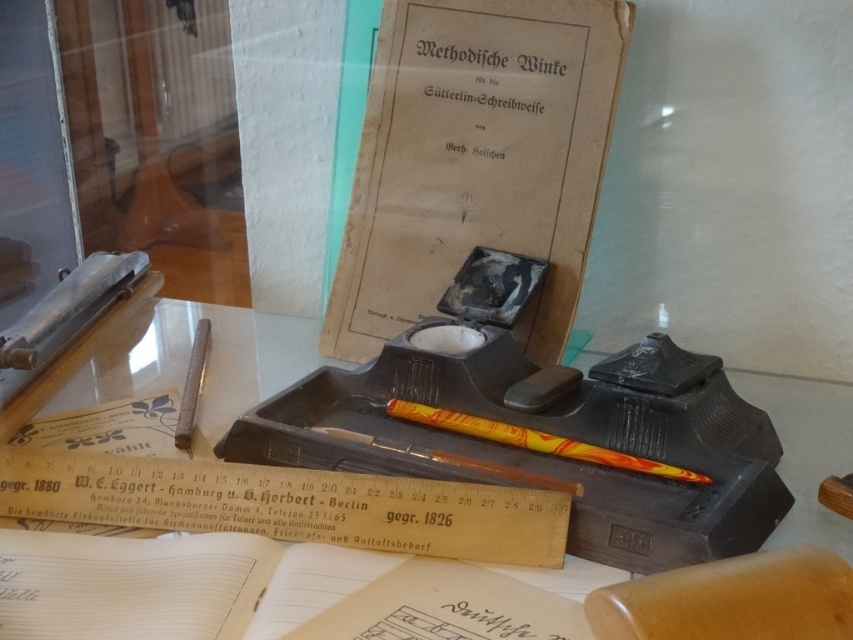
Question: Is matte black inkwell at center smaller than marbled yellow-orange pencil at center?

Choices:
 (A) yes
 (B) no

Answer: (B)

Question: Observing the image, what is the correct spatial positioning of matte black inkwell at center in reference to marbled yellow-orange pencil at center?

Choices:
 (A) left
 (B) right

Answer: (A)

Question: Which object is positioned farthest from the matte black inkwell at center?

Choices:
 (A) marbled yellow-orange pencil at center
 (B) wooden ruler at lower center

Answer: (A)

Question: Which of the following is the closest to the observer?

Choices:
 (A) (646, 468)
 (B) (178, 476)
 (C) (840, 522)

Answer: (C)

Question: Does wooden ruler at lower center lie behind matte black inkwell at center?

Choices:
 (A) yes
 (B) no

Answer: (B)

Question: Which point appears farthest from the camera in this image?

Choices:
 (A) (572, 452)
 (B) (830, 397)

Answer: (B)